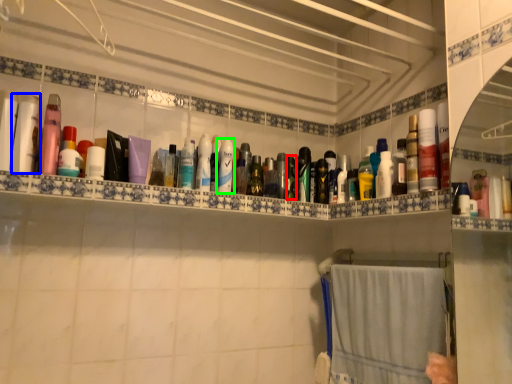
Question: Considering the real-world distances, which object is farthest from toiletry (highlighted by a red box)? toiletry (highlighted by a blue box) or toiletry (highlighted by a green box)?

Choices:
 (A) toiletry
 (B) toiletry

Answer: (A)